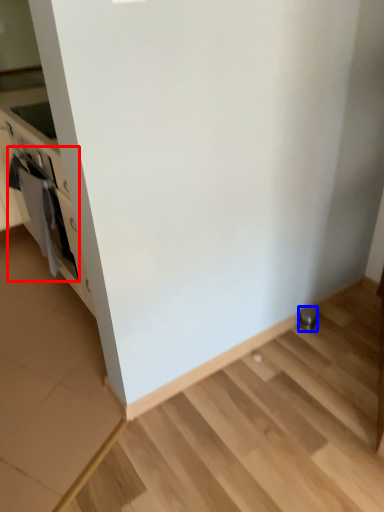
Question: Which point is closer to the camera, oven (highlighted by a red box) or appliance (highlighted by a blue box)?

Choices:
 (A) oven
 (B) appliance

Answer: (A)